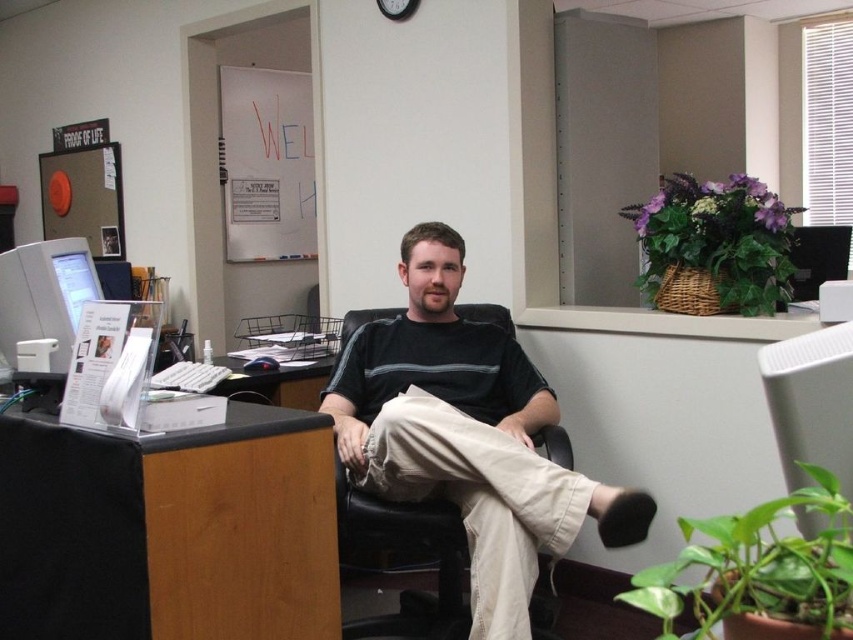
Can you confirm if black matte computer desk at lower left is positioned below dark gray striped shirt at center?

Correct, black matte computer desk at lower left is located below dark gray striped shirt at center.

Identify the location of black matte computer desk at lower left. [x=169, y=531].

Image resolution: width=853 pixels, height=640 pixels. I want to click on black matte computer desk at lower left, so click(169, 531).